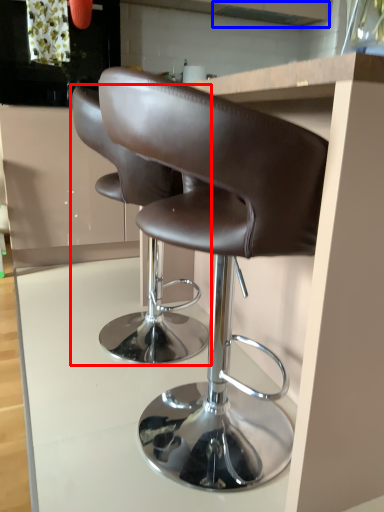
Question: Among these objects, which one is nearest to the camera, chair (highlighted by a red box) or exhaust hood (highlighted by a blue box)?

Choices:
 (A) chair
 (B) exhaust hood

Answer: (A)